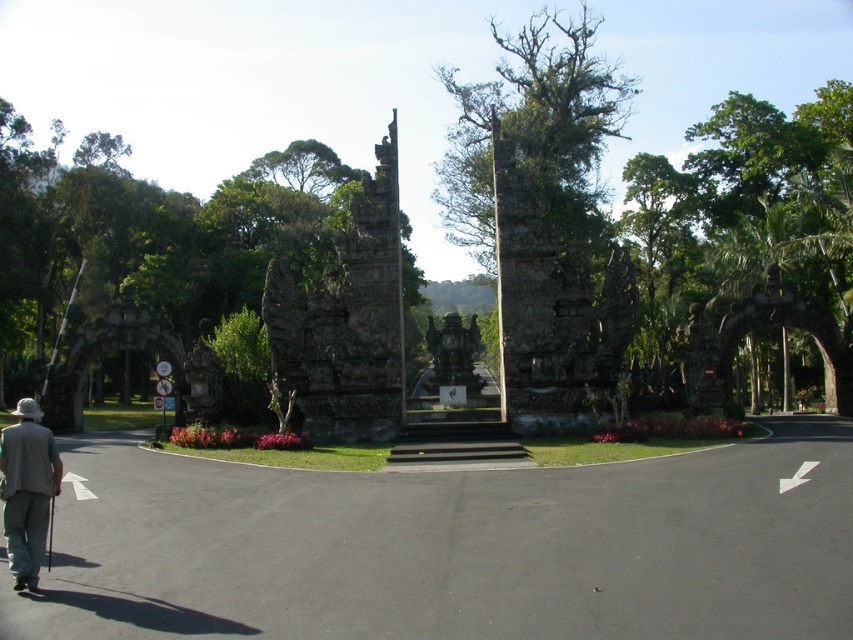
Question: Is rough stone archway at center below gray fabric vest at lower left?

Choices:
 (A) yes
 (B) no

Answer: (B)

Question: Can you confirm if rough stone archway at center is positioned above rustic stone gate at center?

Choices:
 (A) yes
 (B) no

Answer: (A)

Question: Which point is closer to the camera?

Choices:
 (A) (9, 435)
 (B) (560, 24)
 (C) (189, 260)
 (D) (451, 371)

Answer: (A)

Question: Which point is farther from the camera taking this photo?

Choices:
 (A) (4, 508)
 (B) (463, 124)
 (C) (451, 320)

Answer: (B)

Question: Which of the following is the farthest from the observer?

Choices:
 (A) green rough stone tree at upper center
 (B) rough stone archway at center

Answer: (B)

Question: Can you confirm if rough stone archway at center is positioned to the right of green rough stone tree at upper center?

Choices:
 (A) yes
 (B) no

Answer: (B)